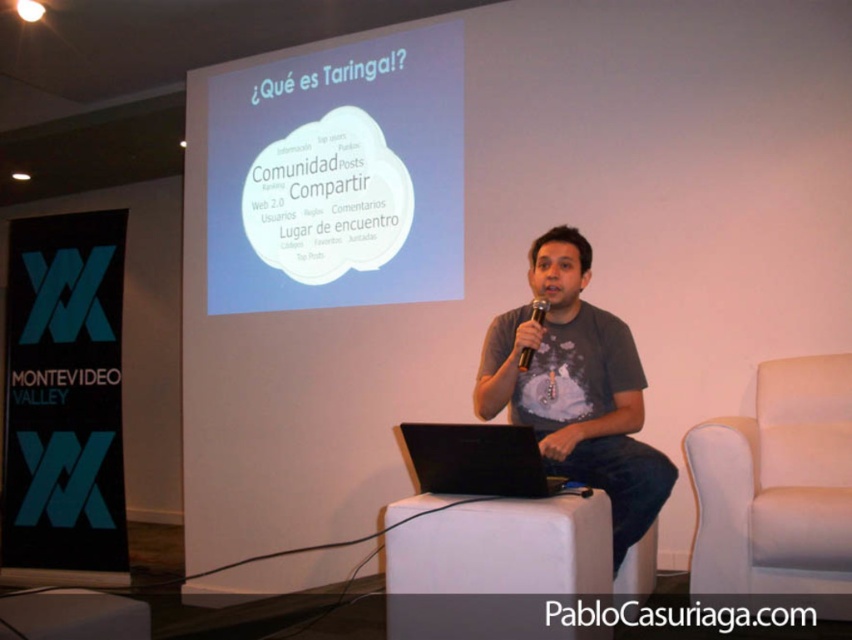
Between white cloud at center and black plastic microphone at center, which one is positioned lower?

black plastic microphone at center is lower down.

Is white cloud at center bigger than black plastic microphone at center?

Indeed, white cloud at center has a larger size compared to black plastic microphone at center.

The width and height of the screenshot is (852, 640). Find the location of `white cloud at center`. white cloud at center is located at coordinates (338, 176).

Locate an element on the screen. This screenshot has height=640, width=852. white cloud at center is located at coordinates (338, 176).

In the scene shown: Who is lower down, gray cotton t-shirt at center or black matte laptop at center?

black matte laptop at center is below.

Can you confirm if gray cotton t-shirt at center is positioned below black matte laptop at center?

Incorrect, gray cotton t-shirt at center is not positioned below black matte laptop at center.

Does point (600, 440) come farther from viewer compared to point (465, 444)?

Yes, it is behind point (465, 444).

Locate an element on the screen. gray cotton t-shirt at center is located at coordinates (576, 388).

Which is above, black paper at left or white leather armchair at right?

black paper at left is above.

What do you see at coordinates (64, 394) in the screenshot? I see `black paper at left` at bounding box center [64, 394].

Where is `black paper at left`? This screenshot has width=852, height=640. black paper at left is located at coordinates (64, 394).